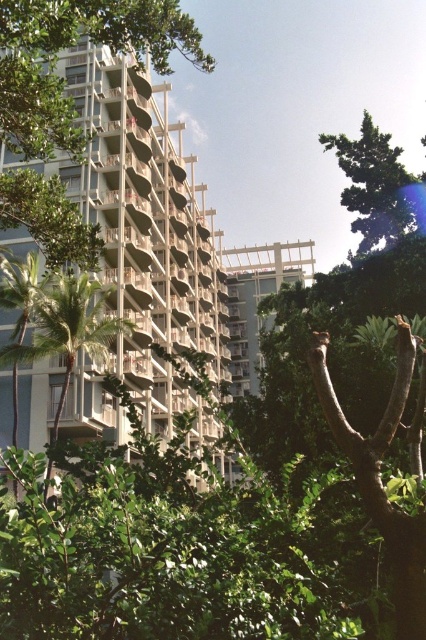
Based on the scene described, which object occupies more horizontal space in the image? Please consider the white textured building at center and the green leafy tree at upper right in your answer.

The white textured building at center has a greater width than the green leafy tree at upper right, so it occupies more horizontal space in the image.

You are standing in front of the building and notice two green leafy trees. Which tree, the green leafy tree at upper right or the green leafy tree at left, appears closer to you?

The green leafy tree at upper right is smaller than the green leafy tree at left, so the green leafy tree at upper right appears closer to you because smaller objects often appear closer in perspective.